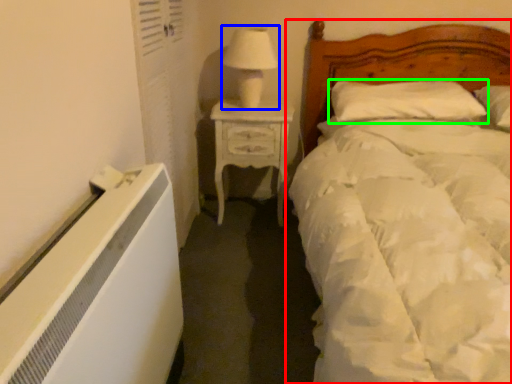
Question: Considering the real-world distances, which object is farthest from bed (highlighted by a red box)? table lamp (highlighted by a blue box) or pillow (highlighted by a green box)?

Choices:
 (A) table lamp
 (B) pillow

Answer: (A)